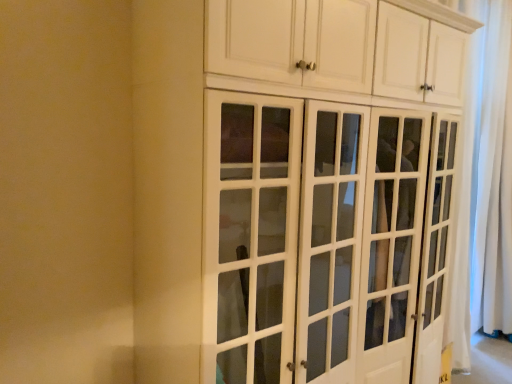
Image resolution: width=512 pixels, height=384 pixels. What do you see at coordinates (293, 188) in the screenshot? I see `white glossy cabinet at center` at bounding box center [293, 188].

The width and height of the screenshot is (512, 384). What are the coordinates of `white glossy cabinet at center` in the screenshot? It's located at (293, 188).

At what (x,y) coordinates should I click in order to perform the action: click on white glossy cabinet at center. Please return your answer as a coordinate pair (x, y). This screenshot has width=512, height=384. Looking at the image, I should click on (293, 188).